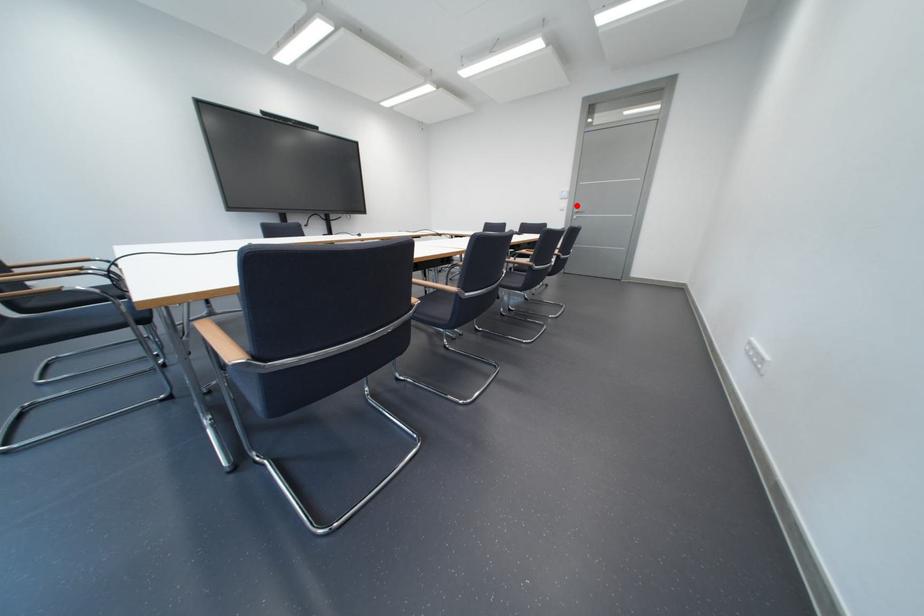
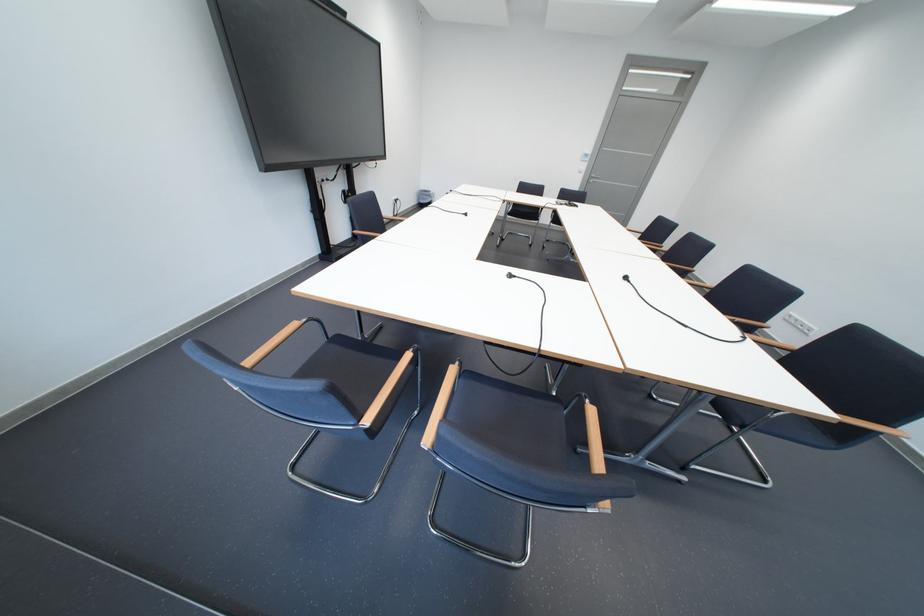
Where in the second image is the point corresponding to the highlighted location from the first image?

(596, 168)